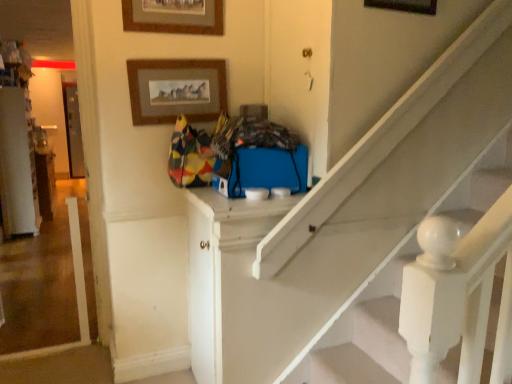
At what (x,y) coordinates should I click in order to perform the action: click on matte blue door at upper center, acting as the second door starting from the bottom. Please return your answer as a coordinate pair (x, y). Image resolution: width=512 pixels, height=384 pixels. Looking at the image, I should click on (298, 72).

Measure the distance between point (202, 211) and camera.

5.81 feet.

You are a GUI agent. You are given a task and a screenshot of the screen. Output one action in this format:
    pyautogui.click(x=<x>, y=<y>)
    Task: Click on the matte blue door at upper center, which appears as the 2th door when viewed from the left
    This screenshot has width=512, height=384.
    Given the screenshot: What is the action you would take?
    pyautogui.click(x=298, y=72)

From the image's perspective, is wooden picture frame at upper center, the third picture frame in the left-to-right sequence, above matte blue door at upper center, marked as the 1th door in a right-to-left arrangement?

Indeed, from the image's perspective, wooden picture frame at upper center, the third picture frame in the left-to-right sequence, is shown above matte blue door at upper center, marked as the 1th door in a right-to-left arrangement.

Is wooden picture frame at upper center, the third picture frame in the left-to-right sequence, surrounding matte blue door at upper center, acting as the second door starting from the bottom?

No, matte blue door at upper center, acting as the second door starting from the bottom, is not inside wooden picture frame at upper center, the third picture frame in the left-to-right sequence.

How far apart are wooden picture frame at upper center, the third picture frame in the left-to-right sequence, and matte blue door at upper center, the 1th door in the top-to-bottom sequence?

wooden picture frame at upper center, the third picture frame in the left-to-right sequence, and matte blue door at upper center, the 1th door in the top-to-bottom sequence, are 16.32 inches apart.

How different are the orientations of matte blue door at upper center, acting as the second door starting from the bottom, and wooden picture frame at upper center, which ranks as the 2th picture frame in left-to-right order, in degrees?

The facing directions of matte blue door at upper center, acting as the second door starting from the bottom, and wooden picture frame at upper center, which ranks as the 2th picture frame in left-to-right order, are 89.6 degrees apart.

Consider the image. Which object is further away from the camera taking this photo, matte blue door at upper center, acting as the second door starting from the bottom, or wooden picture frame at upper center, the 2th picture frame when ordered from right to left?

wooden picture frame at upper center, the 2th picture frame when ordered from right to left, is further away from the camera.

Is matte blue door at upper center, which appears as the 2th door when viewed from the left, not within wooden picture frame at upper center, the 2th picture frame when ordered from right to left?

Indeed, matte blue door at upper center, which appears as the 2th door when viewed from the left, is completely outside wooden picture frame at upper center, the 2th picture frame when ordered from right to left.

Considering the sizes of objects matte blue door at upper center, marked as the 1th door in a right-to-left arrangement, and wooden picture frame at upper center, the 2th picture frame when ordered from right to left, in the image provided, who is taller, matte blue door at upper center, marked as the 1th door in a right-to-left arrangement, or wooden picture frame at upper center, the 2th picture frame when ordered from right to left,?

matte blue door at upper center, marked as the 1th door in a right-to-left arrangement.

Is wooden picture frame at upper center, which is counted as the 1th picture frame, starting from the left, to the left of wooden picture frame at upper center, the third picture frame in the left-to-right sequence, from the viewer's perspective?

Yes.

Considering their positions, is wooden picture frame at upper center, which is counted as the 1th picture frame, starting from the left, located in front of or behind wooden picture frame at upper center, the third picture frame in the left-to-right sequence?

Visually, wooden picture frame at upper center, which is counted as the 1th picture frame, starting from the left, is located behind wooden picture frame at upper center, the third picture frame in the left-to-right sequence.

Consider the image. Could you tell me if wooden picture frame at upper center, the 3th picture frame when ordered from right to left, is facing wooden picture frame at upper center, which is the first picture frame in right-to-left order?

No, wooden picture frame at upper center, the 3th picture frame when ordered from right to left, is not turned towards wooden picture frame at upper center, which is the first picture frame in right-to-left order.

Where is `the 1st picture frame positioned above the white painted wood door at center, placed as the second door when sorted from right to left (from a real-world perspective)`? This screenshot has width=512, height=384. the 1st picture frame positioned above the white painted wood door at center, placed as the second door when sorted from right to left (from a real-world perspective) is located at coordinates (176, 90).

From the image's perspective, which one is positioned lower, white painted wood door at center, placed as the second door when sorted from right to left, or wooden picture frame at upper center, which ranks as the 2th picture frame in left-to-right order?

white painted wood door at center, placed as the second door when sorted from right to left, appears lower in the image.

Are white painted wood door at center, the 1th door from the left, and wooden picture frame at upper center, which ranks as the 2th picture frame in left-to-right order, making contact?

No, white painted wood door at center, the 1th door from the left, is not next to wooden picture frame at upper center, which ranks as the 2th picture frame in left-to-right order.

Which of these two, white painted wood door at center, placed as the second door when sorted from right to left, or wooden picture frame at upper center, the 2th picture frame when ordered from right to left, is bigger?

white painted wood door at center, placed as the second door when sorted from right to left.

Find the location of a particular element. picture frame below the wooden picture frame at upper center, which is counted as the 1th picture frame, starting from the left (from a real-world perspective) is located at coordinates pos(176,90).

Which point is more forward, (211, 13) or (207, 74)?

The point (211, 13) is in front.

Can you confirm if wooden picture frame at upper center, which is counted as the 1th picture frame, starting from the left, is wider than wooden picture frame at upper center, which ranks as the 2th picture frame in left-to-right order?

In fact, wooden picture frame at upper center, which is counted as the 1th picture frame, starting from the left, might be narrower than wooden picture frame at upper center, which ranks as the 2th picture frame in left-to-right order.

Between matte blue door at upper center, marked as the 1th door in a right-to-left arrangement, and white painted wood door at center, the first door in the bottom-to-top sequence, which one is positioned in front?

Positioned in front is matte blue door at upper center, marked as the 1th door in a right-to-left arrangement.

Do you think matte blue door at upper center, the 1th door in the top-to-bottom sequence, is within white painted wood door at center, which is counted as the second door, starting from the top, or outside of it?

matte blue door at upper center, the 1th door in the top-to-bottom sequence, cannot be found inside white painted wood door at center, which is counted as the second door, starting from the top.

Does matte blue door at upper center, which appears as the 2th door when viewed from the left, have a larger size compared to white painted wood door at center, which is counted as the second door, starting from the top?

No.

In the image, is white painted wood door at center, the 1th door from the left, on the left side or the right side of matte blue door at upper center, the 1th door in the top-to-bottom sequence?

Based on their positions, white painted wood door at center, the 1th door from the left, is located to the left of matte blue door at upper center, the 1th door in the top-to-bottom sequence.

From a real-world perspective, is white painted wood door at center, which is counted as the second door, starting from the top, above or below matte blue door at upper center, which appears as the 2th door when viewed from the left?

white painted wood door at center, which is counted as the second door, starting from the top, is below matte blue door at upper center, which appears as the 2th door when viewed from the left.

Where is `door on the right of white painted wood door at center, the 1th door from the left`? door on the right of white painted wood door at center, the 1th door from the left is located at coordinates (298, 72).

Identify the location of picture frame that is on the right side of matte blue door at upper center, which appears as the 2th door when viewed from the left. This screenshot has height=384, width=512. (405, 5).

Find the location of a particular element. This screenshot has width=512, height=384. door above the wooden picture frame at upper center, which ranks as the 2th picture frame in left-to-right order (from a real-world perspective) is located at coordinates (298, 72).

Based on their spatial positions, is wooden picture frame at upper center, the 3th picture frame when ordered from right to left, or wooden picture frame at upper center, which ranks as the 2th picture frame in left-to-right order, closer to matte blue door at upper center, acting as the second door starting from the bottom?

wooden picture frame at upper center, which ranks as the 2th picture frame in left-to-right order, lies closer to matte blue door at upper center, acting as the second door starting from the bottom, than the other object.

Which object lies nearer to the anchor point wooden picture frame at upper center, which is the first picture frame in right-to-left order, matte blue door at upper center, marked as the 1th door in a right-to-left arrangement, or wooden picture frame at upper center, which ranks as the 2th picture frame in left-to-right order?

matte blue door at upper center, marked as the 1th door in a right-to-left arrangement, is positioned closer to the anchor wooden picture frame at upper center, which is the first picture frame in right-to-left order.

From the image, which object appears to be farther from matte blue door at upper center, acting as the second door starting from the bottom, white painted wood door at center, placed as the second door when sorted from right to left, or wooden picture frame at upper center, the third picture frame in the left-to-right sequence?

Among the two, white painted wood door at center, placed as the second door when sorted from right to left, is located further to matte blue door at upper center, acting as the second door starting from the bottom.

Estimate the real-world distances between objects in this image. Which object is further from matte blue door at upper center, which appears as the 2th door when viewed from the left, wooden picture frame at upper center, which ranks as the 2th picture frame in left-to-right order, or wooden picture frame at upper center, which is counted as the 1th picture frame, starting from the left?

Among the two, wooden picture frame at upper center, which is counted as the 1th picture frame, starting from the left, is located further to matte blue door at upper center, which appears as the 2th door when viewed from the left.

When comparing their distances from wooden picture frame at upper center, the third picture frame in the left-to-right sequence, does matte blue door at upper center, the 1th door in the top-to-bottom sequence, or wooden picture frame at upper center, the 3th picture frame when ordered from right to left, seem further?

Among the two, wooden picture frame at upper center, the 3th picture frame when ordered from right to left, is located further to wooden picture frame at upper center, the third picture frame in the left-to-right sequence.

Considering their positions, is wooden picture frame at upper center, the 3th picture frame when ordered from right to left, positioned further to white painted wood door at center, the 1th door from the left, than wooden picture frame at upper center, which is the first picture frame in right-to-left order?

wooden picture frame at upper center, which is the first picture frame in right-to-left order, is further to white painted wood door at center, the 1th door from the left.

Considering their positions, is wooden picture frame at upper center, which ranks as the 2th picture frame in left-to-right order, positioned further to matte blue door at upper center, which appears as the 2th door when viewed from the left, than white painted wood door at center, which is counted as the second door, starting from the top?

Among the two, white painted wood door at center, which is counted as the second door, starting from the top, is located further to matte blue door at upper center, which appears as the 2th door when viewed from the left.

From the image, which object appears to be farther from wooden picture frame at upper center, the 3th picture frame when ordered from right to left, wooden picture frame at upper center, the 2th picture frame when ordered from right to left, or wooden picture frame at upper center, which is the first picture frame in right-to-left order?

wooden picture frame at upper center, which is the first picture frame in right-to-left order.

At what (x,y) coordinates should I click in order to perform the action: click on door between wooden picture frame at upper center, which ranks as the 2th picture frame in left-to-right order, and white painted wood door at center, the first door in the bottom-to-top sequence, in the up-down direction. Please return your answer as a coordinate pair (x, y). Looking at the image, I should click on (298, 72).

This screenshot has width=512, height=384. In order to click on picture frame between wooden picture frame at upper center, which is counted as the 1th picture frame, starting from the left, and white painted wood door at center, the first door in the bottom-to-top sequence, in the up-down direction in this screenshot , I will do `click(176, 90)`.

The height and width of the screenshot is (384, 512). Identify the location of door between wooden picture frame at upper center, which is counted as the 1th picture frame, starting from the left, and white painted wood door at center, the first door in the bottom-to-top sequence, from top to bottom. (298, 72).

Find the location of a particular element. This screenshot has width=512, height=384. door between wooden picture frame at upper center, which is the first picture frame in right-to-left order, and white painted wood door at center, the first door in the bottom-to-top sequence, from top to bottom is located at coordinates (298, 72).